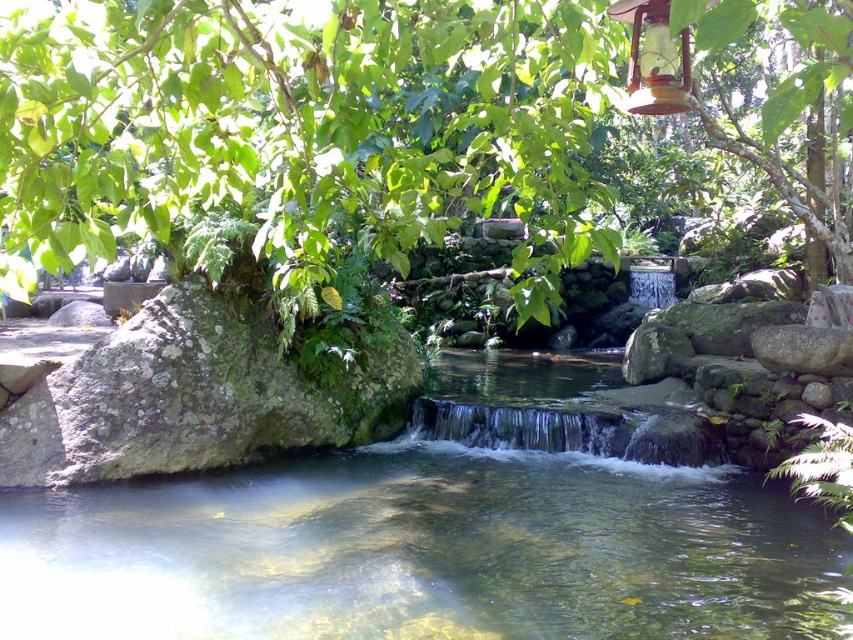
Between green leafy tree at upper center and clear water stream at center, which one has less height?

With less height is clear water stream at center.

Is point (160, 116) positioned before point (157, 516)?

Yes, it is in front of point (157, 516).

Locate an element on the screen. green leafy tree at upper center is located at coordinates (303, 125).